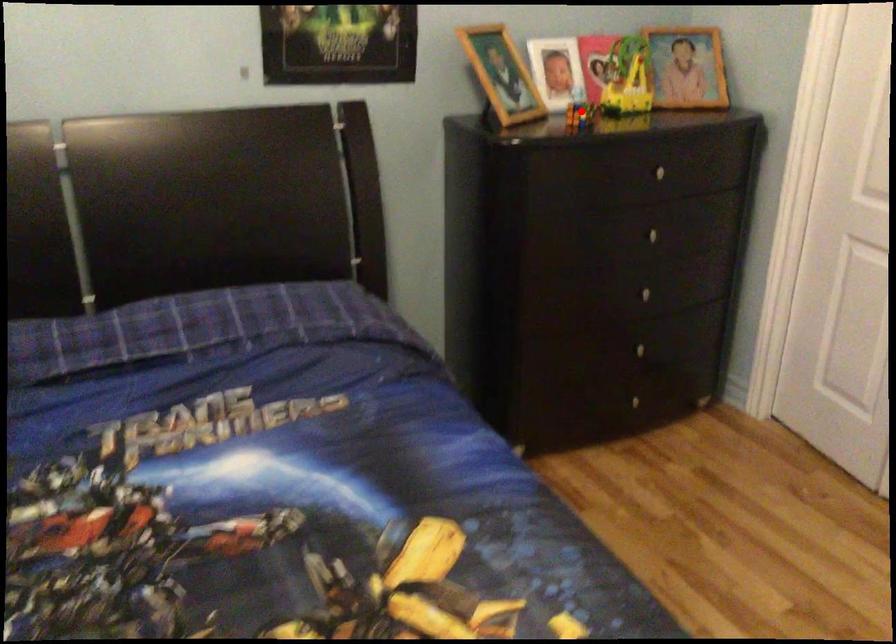
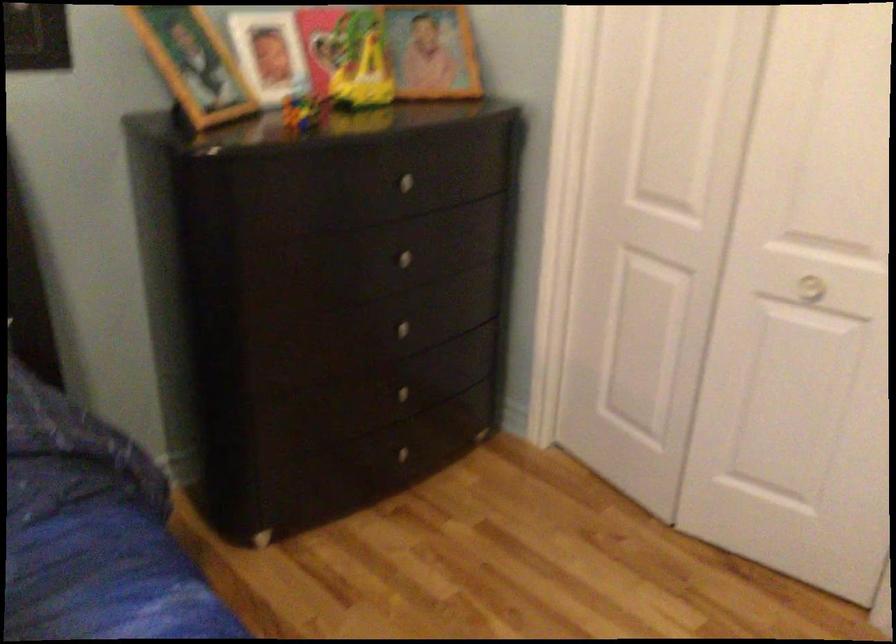
Locate, in the second image, the point that corresponds to the highlighted location in the first image.

(303, 111)